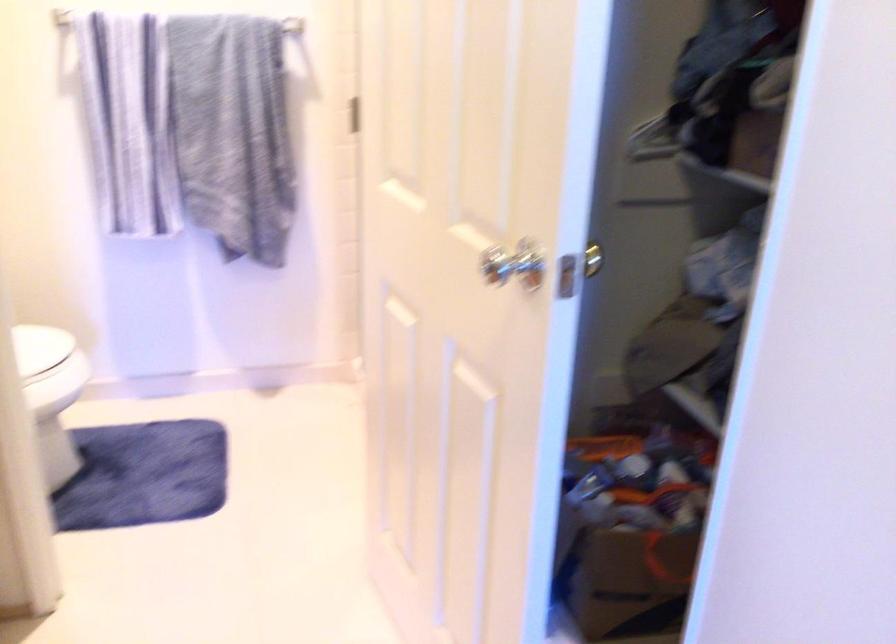
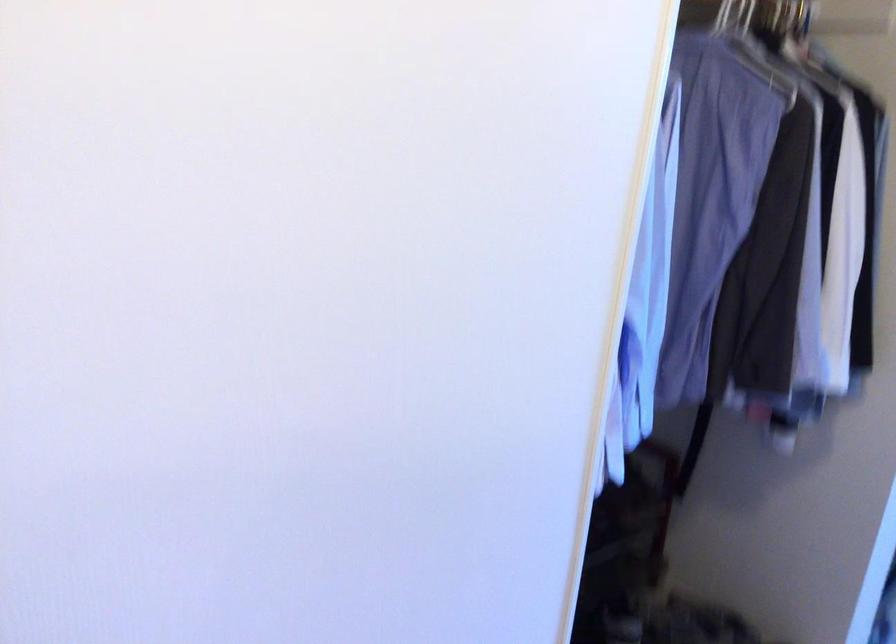
Based on the continuous images, in which direction is the camera rotating?

The rotation direction of the camera is right-down.